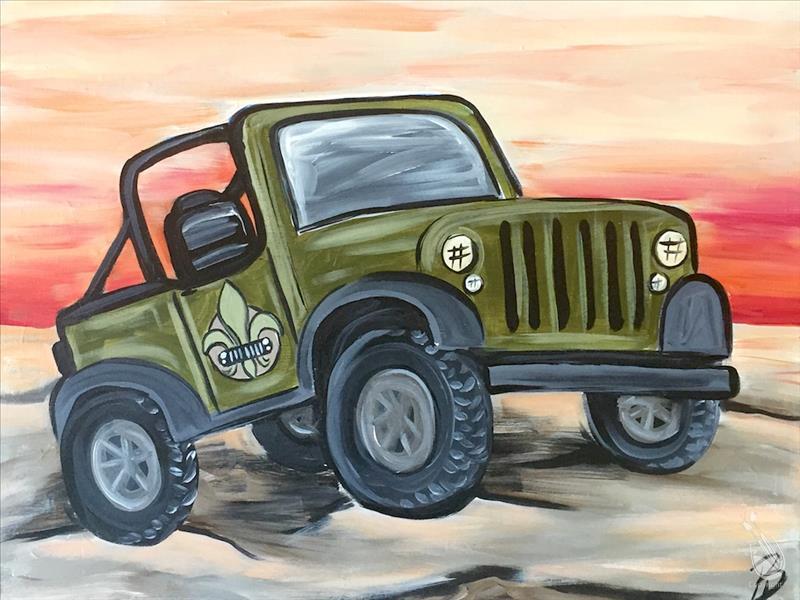
Where is `black bottom door frame`? black bottom door frame is located at coordinates (270, 401).